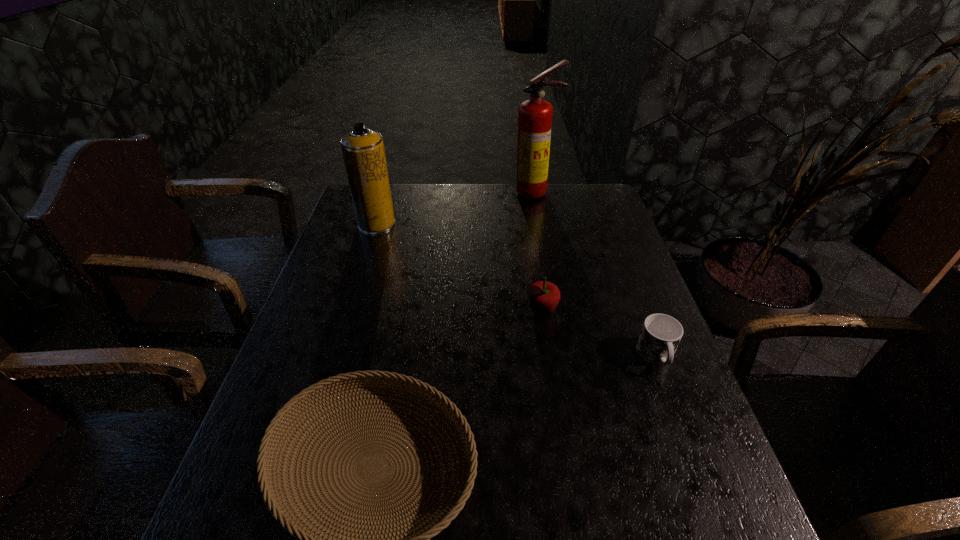
Locate an element on the screen. free location at the near left corner of the desktop is located at coordinates (263, 538).

The image size is (960, 540). I want to click on vacant space at the far right corner, so click(x=592, y=219).

In order to click on free spot between the farthest object and the second farthest object in this screenshot , I will do click(x=456, y=208).

In order to click on free point between the second tallest object and the tallest object in this screenshot , I will do `click(456, 208)`.

Where is `empty location between the second farthest object and the apple`? The height and width of the screenshot is (540, 960). empty location between the second farthest object and the apple is located at coordinates (459, 267).

The image size is (960, 540). Find the location of `free spot between the tallest object and the second tallest object`. free spot between the tallest object and the second tallest object is located at coordinates (456, 208).

Identify the location of vacant area that lies between the fourth shortest object and the farthest object. The width and height of the screenshot is (960, 540). (456, 208).

Image resolution: width=960 pixels, height=540 pixels. In order to click on object that stands as the closest to the third tallest object in this screenshot , I will do `click(660, 335)`.

Identify which object is the fourth closest to the nearest object. Please provide its 2D coordinates. Your answer should be formatted as a tuple, i.e. [(x, y)], where the tuple contains the x and y coordinates of a point satisfying the conditions above.

[(534, 115)]